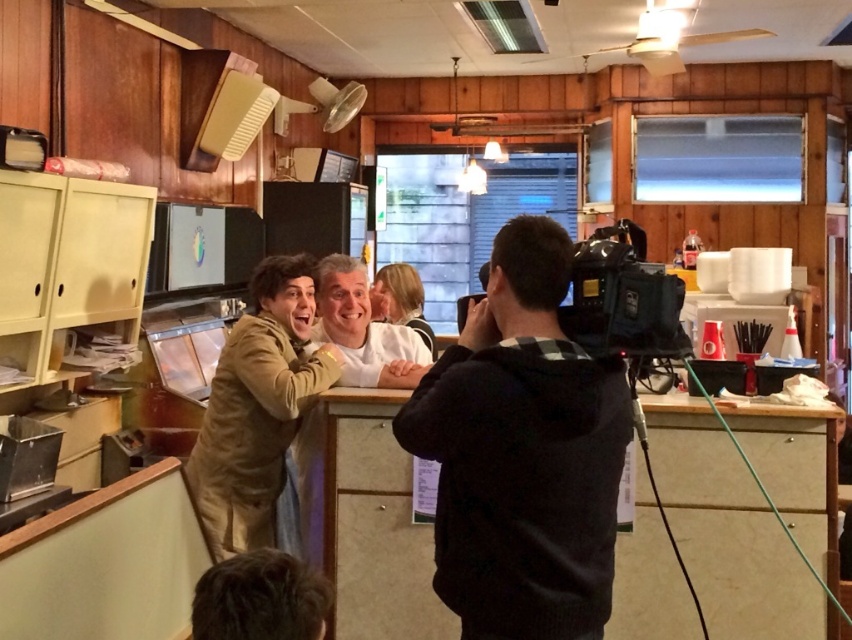
What are the coordinates of the black fabric camera at center?

The black fabric camera at center is located at coordinates point (522, 452).

You are a camera operator in the diner scene. You need to adjust the focus so that both the point at coordinates point (499,268) and the point at coordinates point (225,428) are in clear view. Since the camera can only focus on one depth at a time, which point should you prioritize focusing on to ensure the other is still somewhat in focus?

You should prioritize focusing on point (225,428) because it is farther from the camera. By focusing on the farther point, the closer point (499,268) will naturally fall within the depth of field, ensuring both are somewhat in focus.